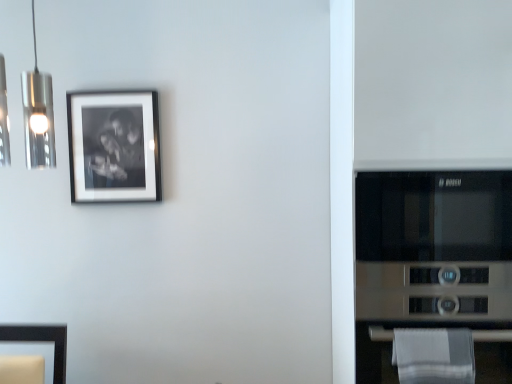
Question: Is white cotton towel at lower right in front of or behind matte black frame at upper left in the image?

Choices:
 (A) behind
 (B) front

Answer: (B)

Question: From the image's perspective, relative to matte black frame at upper left, is white cotton towel at lower right above or below?

Choices:
 (A) above
 (B) below

Answer: (B)

Question: Which of these objects is positioned closest to the stainless steel microwave at right?

Choices:
 (A) white cotton towel at lower right
 (B) matte black frame at upper left

Answer: (A)

Question: Estimate the real-world distances between objects in this image. Which object is closer to the white cotton towel at lower right?

Choices:
 (A) stainless steel microwave at right
 (B) matte black frame at upper left

Answer: (A)